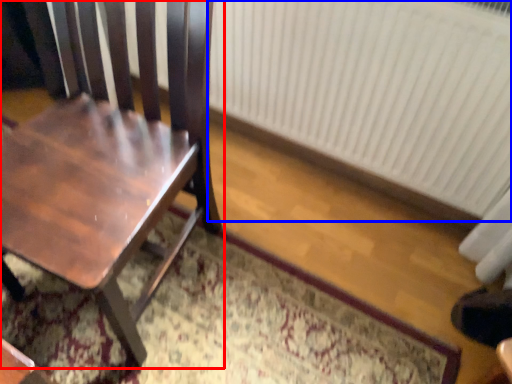
Question: Which point is closer to the camera, chair (highlighted by a red box) or radiator (highlighted by a blue box)?

Choices:
 (A) chair
 (B) radiator

Answer: (A)